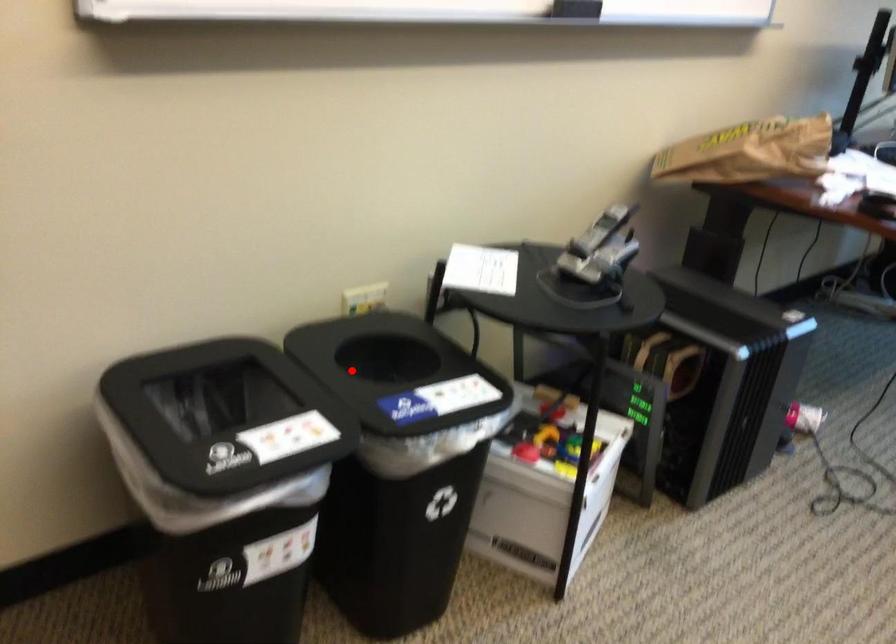
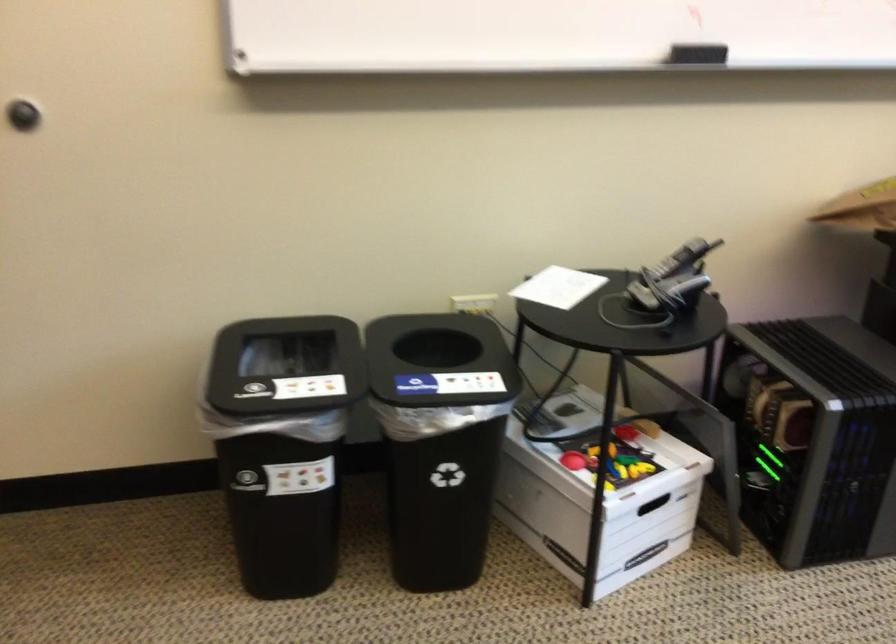
Find the pixel in the second image that matches the highlighted location in the first image.

(438, 361)